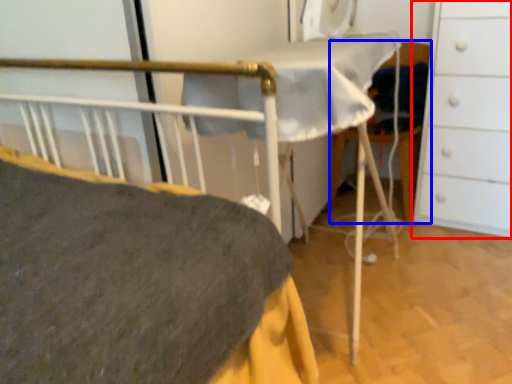
Question: Which object appears closest to the camera in this image, chest of drawers (highlighted by a red box) or folding chair (highlighted by a blue box)?

Choices:
 (A) chest of drawers
 (B) folding chair

Answer: (A)